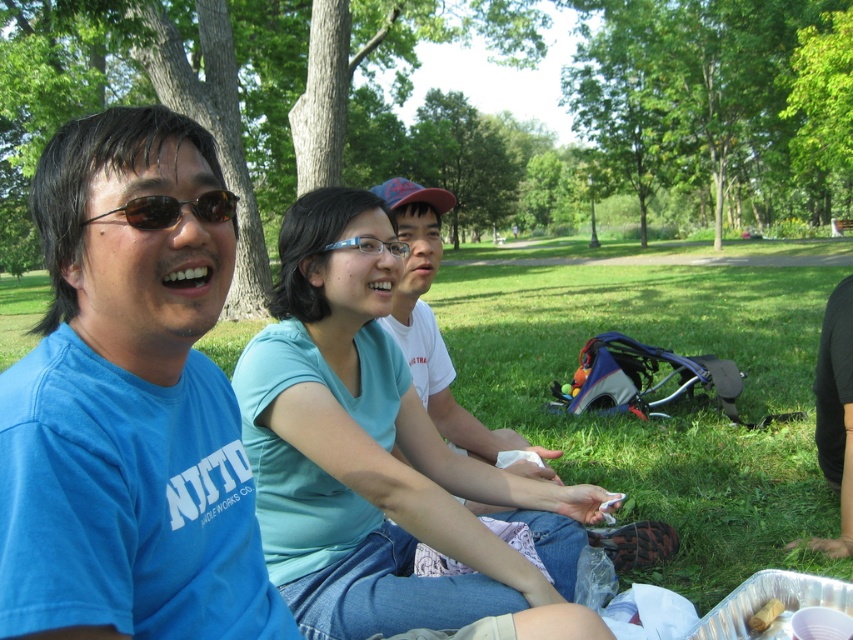
You are standing at the origin point in the image. Which of the two points, point (x=374, y=241) or point (x=769, y=611), is closer to you?

Point (x=374, y=241) is in front of point (x=769, y=611), so it is closer to you.

You are a photographer setting up a tripod to capture the scene. You need to place the tripod between the blue plastic glasses at center and the brown paper bag at lower right. Will the tripod, which requires 30 cm of space, fit in the area between them?

The blue plastic glasses at center is located above the brown paper bag at lower right, so the vertical space between them may not provide enough horizontal space for the tripod. The vertical distance might be insufficient for the 30 cm requirement.